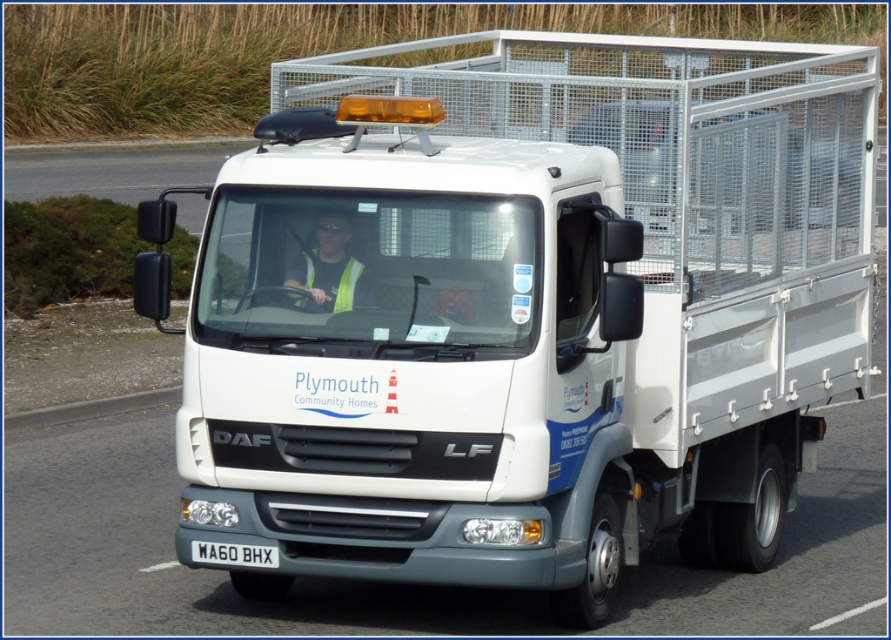
Question: Does white plastic license plate at center have a greater width compared to yellow reflective safety vest at center?

Choices:
 (A) yes
 (B) no

Answer: (A)

Question: Which point is closer to the camera?

Choices:
 (A) yellow reflective safety vest at center
 (B) white plastic license plate at center
 (C) yellow reflective vest at center

Answer: (C)

Question: Can you confirm if yellow reflective vest at center is smaller than yellow reflective safety vest at center?

Choices:
 (A) no
 (B) yes

Answer: (A)

Question: Which point is farther from the camera taking this photo?

Choices:
 (A) (256, 552)
 (B) (309, 288)

Answer: (B)

Question: Based on their relative distances, which object is farther from the white plastic license plate at center?

Choices:
 (A) yellow reflective safety vest at center
 (B) yellow reflective vest at center

Answer: (B)

Question: Does yellow reflective vest at center have a greater width compared to white plastic license plate at center?

Choices:
 (A) no
 (B) yes

Answer: (A)